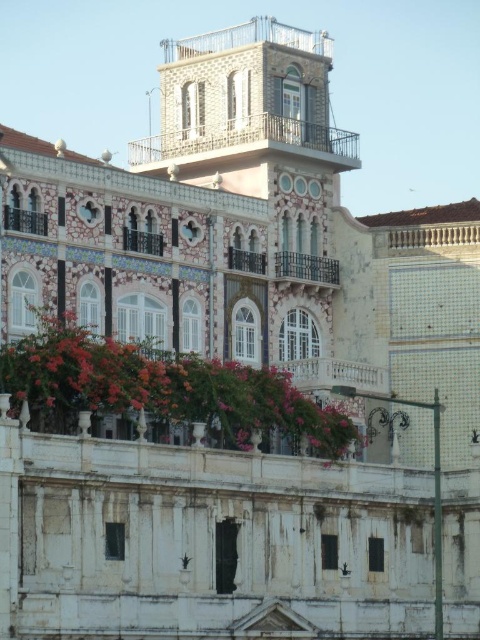
In the scene shown: Does metallic railing at upper center have a lesser height compared to white stone balcony at center?

In fact, metallic railing at upper center may be taller than white stone balcony at center.

Is metallic railing at upper center below white stone balcony at center?

Incorrect, metallic railing at upper center is not positioned below white stone balcony at center.

Measure the distance between metallic railing at upper center and camera.

290.81 feet

Locate an element on the screen. metallic railing at upper center is located at coordinates (248, 38).

Describe the element at coordinates (162, 388) in the screenshot. I see `vivid pink petals at center` at that location.

Locate an element on the screen. Image resolution: width=480 pixels, height=640 pixels. vivid pink petals at center is located at coordinates (162, 388).

Which is more to the right, vivid pink petals at center or rustic wood balcony at center?

rustic wood balcony at center

Between vivid pink petals at center and rustic wood balcony at center, which one has less height?

Standing shorter between the two is rustic wood balcony at center.

Image resolution: width=480 pixels, height=640 pixels. Find the location of `vivid pink petals at center`. vivid pink petals at center is located at coordinates (162, 388).